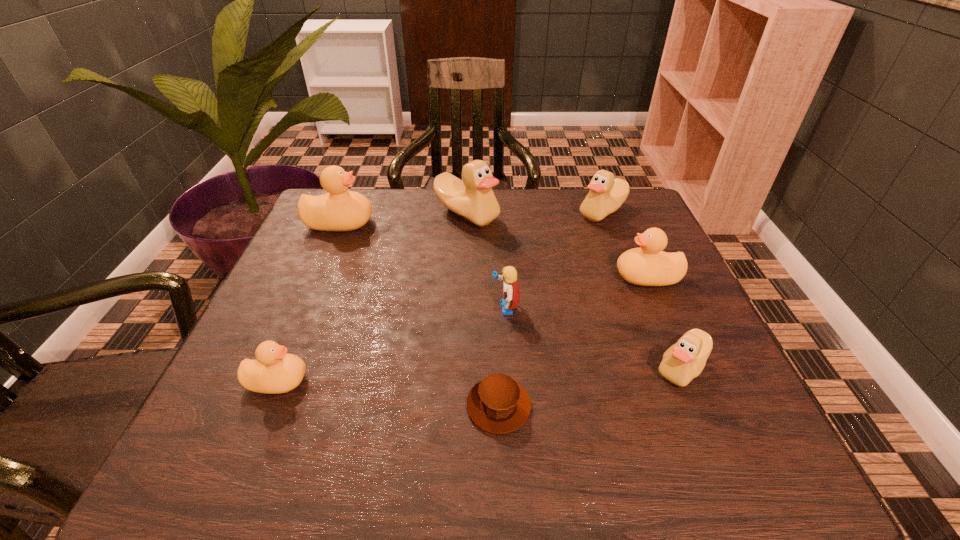
Where is `the closest beige duck to the smallest beige duck`? the closest beige duck to the smallest beige duck is located at coordinates (607, 194).

Choose which yellow duck is the nearest neighbor to the fourth farthest duck. Please provide its 2D coordinates. Your answer should be formatted as a tuple, i.e. [(x, y)], where the tuple contains the x and y coordinates of a point satisfying the conditions above.

[(338, 210)]

Identify which yellow duck is the second nearest to the rightmost yellow duck. Please provide its 2D coordinates. Your answer should be formatted as a tuple, i.e. [(x, y)], where the tuple contains the x and y coordinates of a point satisfying the conditions above.

[(274, 371)]

At what (x,y) coordinates should I click in order to perform the action: click on free point that satisfies the following two spatial constraints: 1. on the back side of the muffin; 2. on the face of the biggest yellow duck. Please return your answer as a coordinate pair (x, y). The width and height of the screenshot is (960, 540). Looking at the image, I should click on (492, 223).

The height and width of the screenshot is (540, 960). I want to click on vacant space that satisfies the following two spatial constraints: 1. at the beak of the second biggest beige duck; 2. at the beak of the fourth duck from right to left, so click(x=603, y=214).